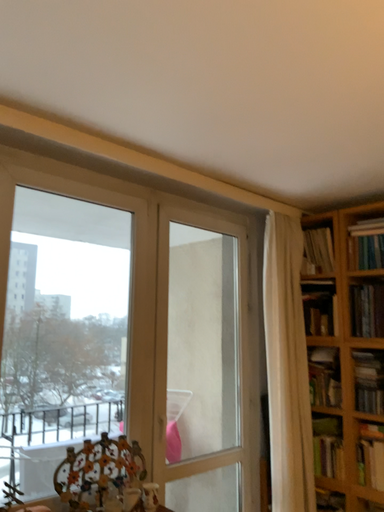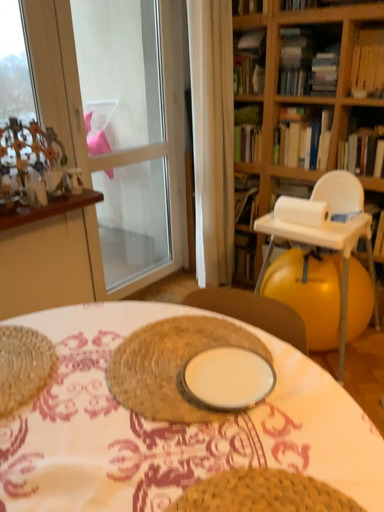
Question: Which way did the camera rotate in the video?

Choices:
 (A) rotated left
 (B) rotated right

Answer: (B)